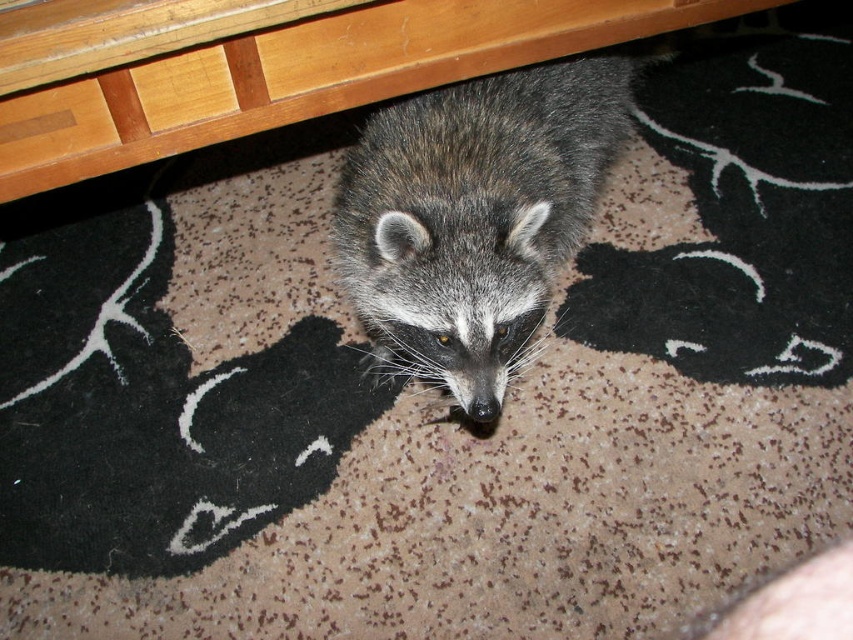
Which of these two, wooden drawer at upper left or wooden drawer at upper center, stands shorter?

wooden drawer at upper center is shorter.

Which is in front, point (94, 148) or point (213, 83)?

Point (213, 83) is in front.

Identify the location of wooden drawer at upper left. The image size is (853, 640). (53, 124).

Does point (491, 33) lie in front of point (218, 80)?

No, it is behind (218, 80).

Between wooden table at upper center and wooden drawer at upper center, which one appears on the left side from the viewer's perspective?

wooden drawer at upper center

Is point (328, 40) behind point (136, 70)?

Yes, point (328, 40) is farther from viewer.

Image resolution: width=853 pixels, height=640 pixels. Identify the location of wooden table at upper center. (303, 76).

Is fuzzy gray raccoon at center positioned at the back of wooden drawer at upper left?

No, fuzzy gray raccoon at center is in front of wooden drawer at upper left.

Is fuzzy gray raccoon at center to the right of wooden drawer at upper left from the viewer's perspective?

Correct, you'll find fuzzy gray raccoon at center to the right of wooden drawer at upper left.

Which is in front, point (491, 273) or point (90, 104)?

Positioned in front is point (491, 273).

Locate an element on the screen. This screenshot has height=640, width=853. fuzzy gray raccoon at center is located at coordinates (474, 214).